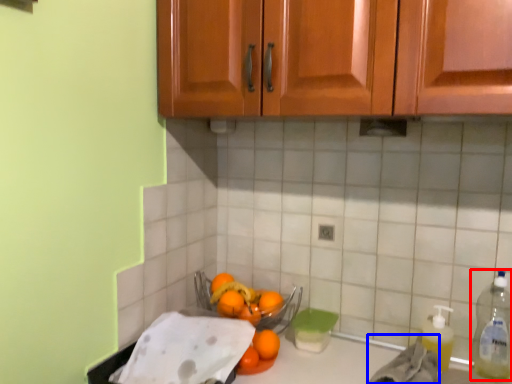
Question: Which object is closer to the camera taking this photo, bottle (highlighted by a red box) or material (highlighted by a blue box)?

Choices:
 (A) bottle
 (B) material

Answer: (B)